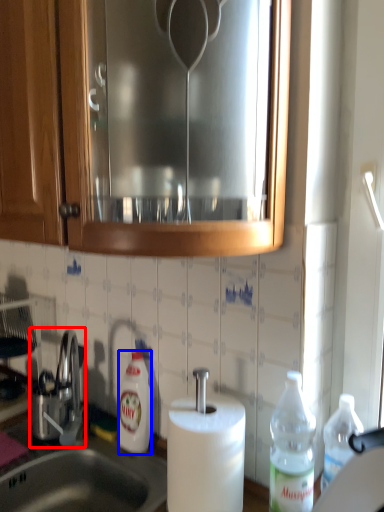
Question: Which of the following is the farthest to the observer, tap (highlighted by a red box) or bottle (highlighted by a blue box)?

Choices:
 (A) tap
 (B) bottle

Answer: (A)